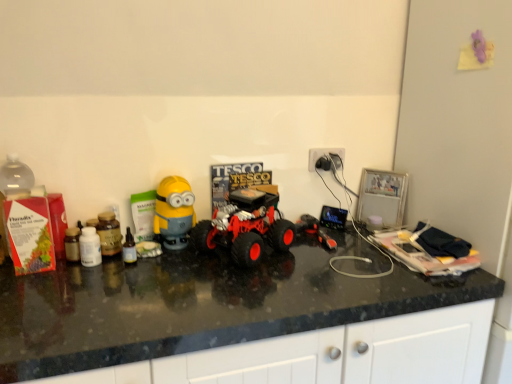
You are a GUI agent. You are given a task and a screenshot of the screen. Output one action in this format:
    pyautogui.click(x=<x>, y=<y>)
    Task: Click on the vacant space to the right of translucent glass bottle at center
    This screenshot has width=512, height=384.
    Given the screenshot: What is the action you would take?
    pyautogui.click(x=178, y=269)